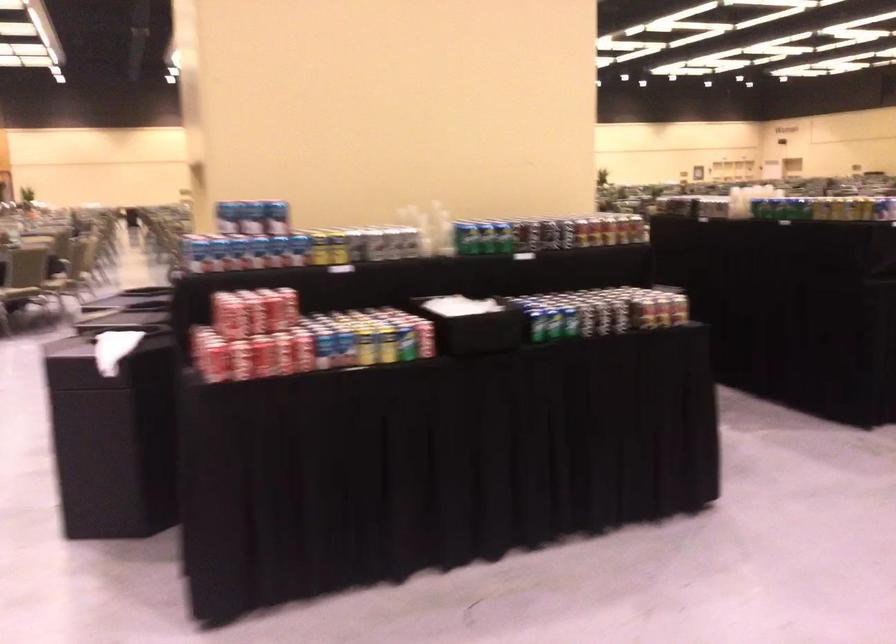
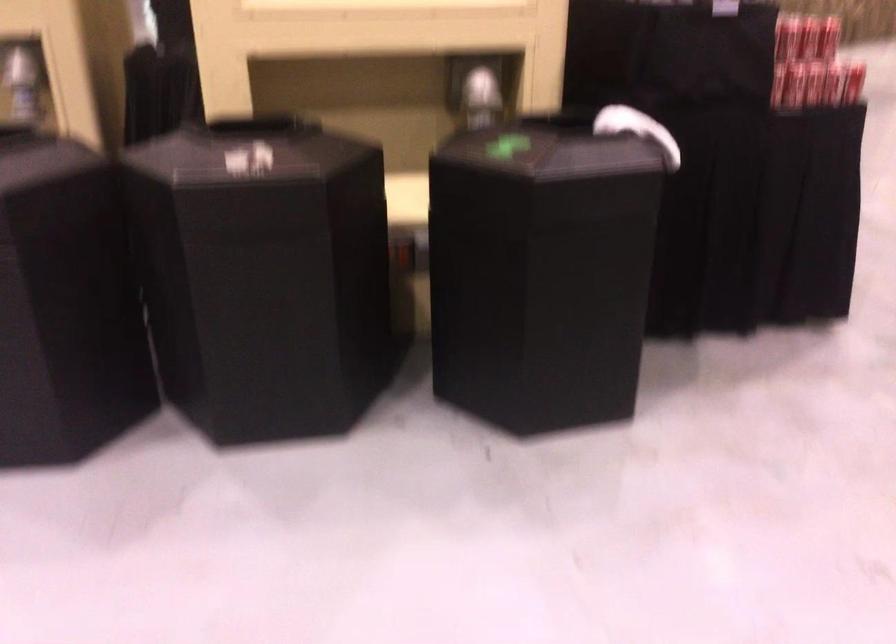
Locate, in the second image, the point that corresponds to the point at 194,357 in the first image.

(833, 84)